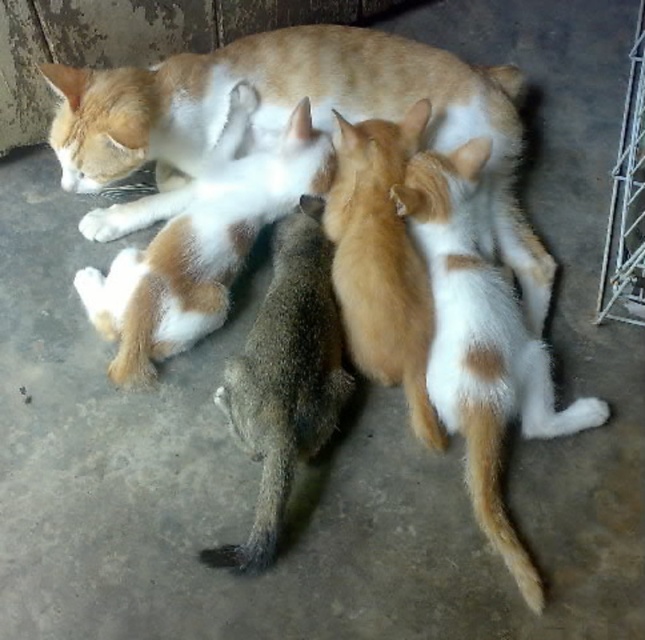
You are a veterinarian examining an image of a cat and kittens. The coordinates point to a specific location in the image. Based on the coordinates given, which cat is located at point (481,348)?

The point (481,348) indicates the orange white fur cat at center.

You are a volunteer at an animal shelter and need to place a new toy in the enclosure. The toy is small enough for the fluffy orange kitten at center to play with but needs to be placed where the metallic silver cage at right won

The fluffy orange kitten at center is to the left of the metallic silver cage at right, so placing the toy between them or near the cage would ensure it is accessible to the kitten while staying within the enclosure.